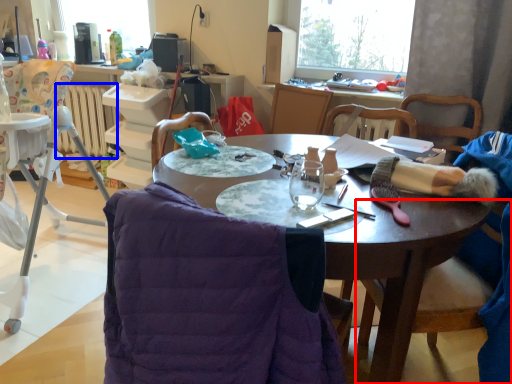
Question: Which object is closer to the camera taking this photo, chair (highlighted by a red box) or radiator (highlighted by a blue box)?

Choices:
 (A) chair
 (B) radiator

Answer: (A)